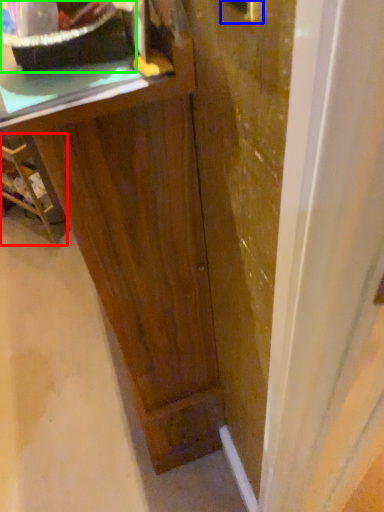
Question: Which is nearer to the furniture (highlighted by a red box)? door handle (highlighted by a blue box) or appliance (highlighted by a green box).

Choices:
 (A) door handle
 (B) appliance

Answer: (B)